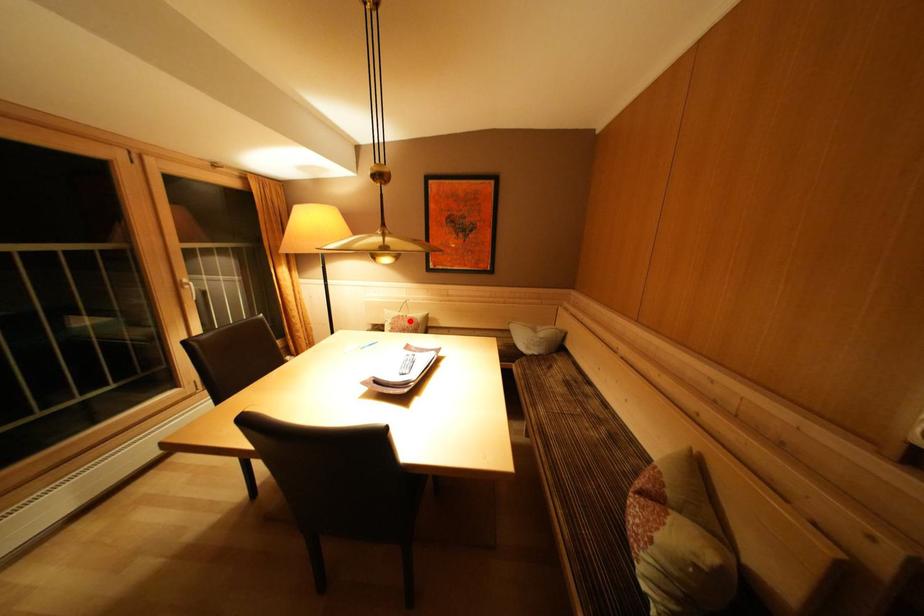
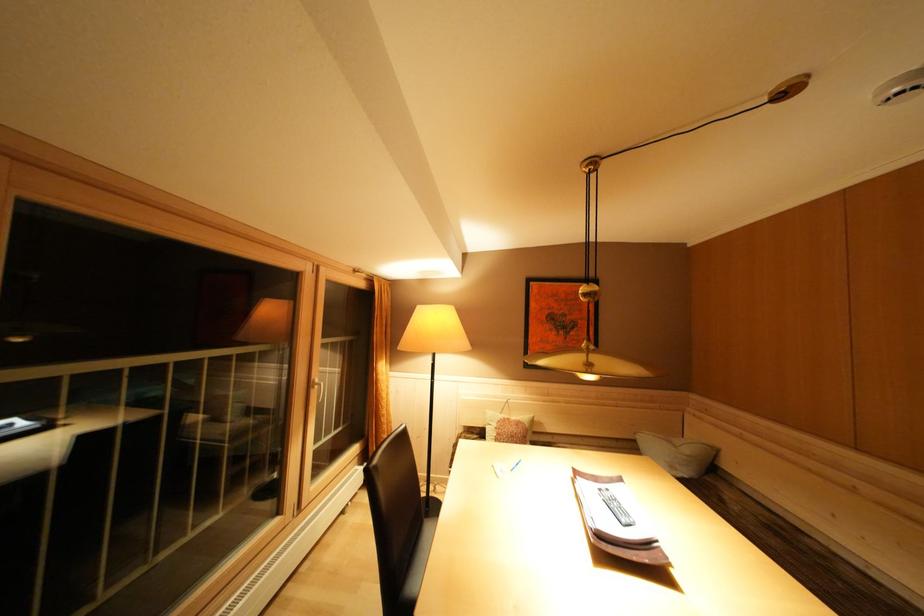
In the second image, find the point that corresponds to the highlighted location in the first image.

(515, 424)